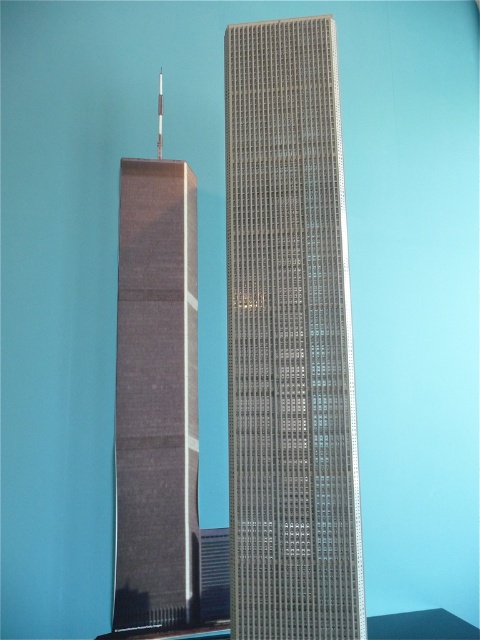
Looking at this image, you are standing in front of the two skyscrapers and want to take a photo. You notice two points marked on the buildings. Which point, point (242, 582) or point (153, 179), is closer to you?

Point (242, 582) is closer to the camera than point (153, 179).

You are standing in a park between two buildings. The sleek glass skyscraper at center and the matte gray tower at left. Which building would appear larger to you?

The sleek glass skyscraper at center appears larger because it is closer to the viewer than the matte gray tower at left.

You are a city planner assessing the skyline. You need to determine which of the two buildings, the sleek glass skyscraper at center or the matte gray tower at left, would cast a longer shadow during midday. Based on their heights, which one would it be?

The sleek glass skyscraper at center is much taller than the matte gray tower at left, so it would cast a longer shadow during midday.